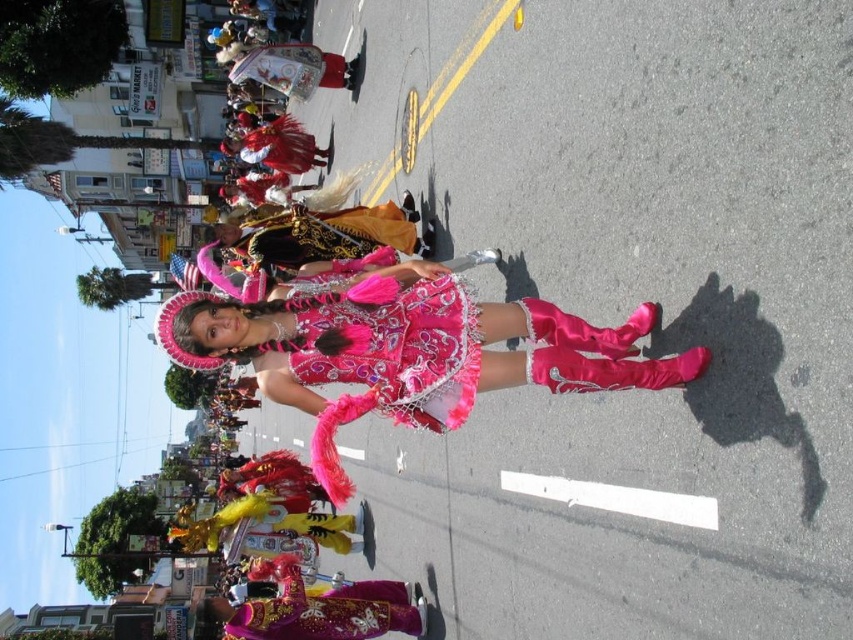
Question: Which object is farther from the camera taking this photo?

Choices:
 (A) shiny gold fabric at center
 (B) shiny satin dress at center

Answer: (A)

Question: Can you confirm if shiny satin dress at center is positioned to the left of shiny gold fabric at center?

Choices:
 (A) yes
 (B) no

Answer: (B)

Question: Can you confirm if shiny satin dress at center is bigger than shiny gold fabric at center?

Choices:
 (A) yes
 (B) no

Answer: (B)

Question: Does shiny gold fabric at center have a lesser width compared to velvet gold and black vest at center?

Choices:
 (A) yes
 (B) no

Answer: (B)

Question: Which object is the closest to the shiny gold fabric at center?

Choices:
 (A) shiny satin dress at center
 (B) velvet gold and black vest at center

Answer: (B)

Question: Among these objects, which one is nearest to the camera?

Choices:
 (A) shiny gold fabric at center
 (B) velvet gold and black vest at center

Answer: (A)